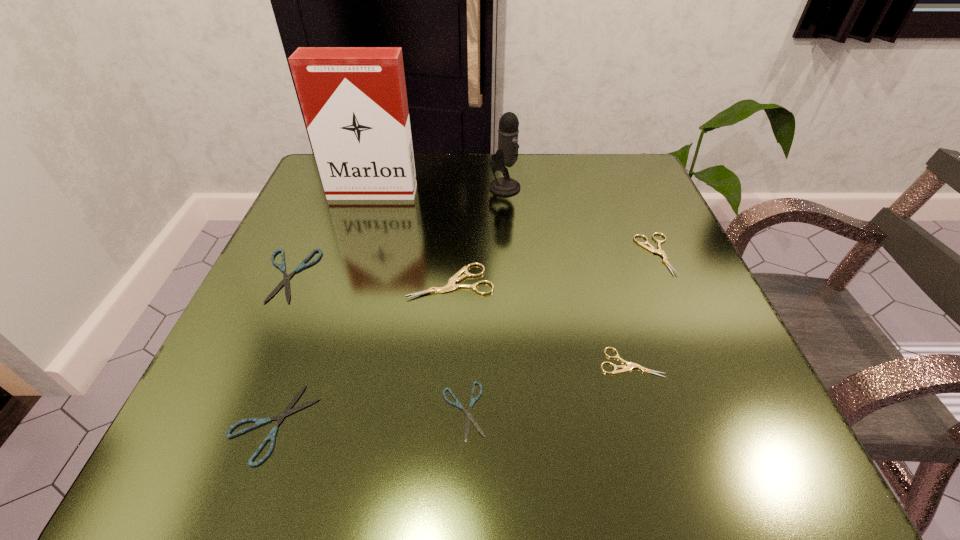
In order to click on the smallest beige shears in this screenshot , I will do `click(630, 365)`.

This screenshot has height=540, width=960. In order to click on the second smallest black shears in this screenshot , I will do `click(287, 411)`.

In order to click on the shortest object in this screenshot , I will do `click(469, 417)`.

Where is `the smallest black shears`? The height and width of the screenshot is (540, 960). the smallest black shears is located at coordinates (469, 417).

Image resolution: width=960 pixels, height=540 pixels. What are the coordinates of `vacant point located 0.300m on the front-facing side of the tallest object` in the screenshot? It's located at (338, 302).

Locate an element on the screen. This screenshot has height=540, width=960. vacant space situated 0.200m on the left of the black microphone is located at coordinates (399, 187).

What are the coordinates of `free space located 0.170m on the left of the tallest shears` in the screenshot? It's located at (310, 282).

Find the location of `vacant region located on the left of the rightmost object`. vacant region located on the left of the rightmost object is located at coordinates (500, 254).

You are a GUI agent. You are given a task and a screenshot of the screen. Output one action in this format:
    pyautogui.click(x=<x>, y=<y>)
    Task: Click on the blank space located 0.150m on the right of the farthest black shears
    
    Given the screenshot: What is the action you would take?
    pyautogui.click(x=398, y=275)

Identify the location of blank area located on the right of the sixth farthest object. (695, 362).